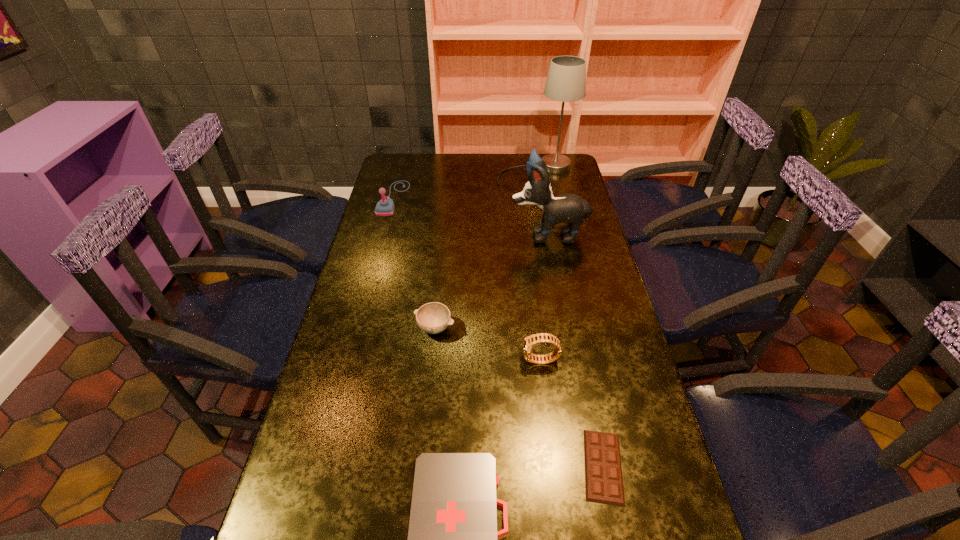
The image size is (960, 540). In order to click on table lamp in this screenshot , I will do `click(566, 82)`.

I want to click on the third farthest object, so click(x=567, y=208).

You are a GUI agent. You are given a task and a screenshot of the screen. Output one action in this format:
    pyautogui.click(x=<x>, y=<y>)
    Task: Click on the puppy
    
    Given the screenshot: What is the action you would take?
    pyautogui.click(x=567, y=208)

What are the coordinates of `the leftmost object` in the screenshot? It's located at (385, 207).

Find the location of a particular element. watch is located at coordinates (529, 341).

This screenshot has height=540, width=960. I want to click on the fourth farthest object, so click(433, 318).

Image resolution: width=960 pixels, height=540 pixels. Find the location of `the fifth tallest object`. the fifth tallest object is located at coordinates (433, 318).

At what (x,y) coordinates should I click in order to perform the action: click on chocolate bar. Please return your answer as a coordinate pair (x, y). Looking at the image, I should click on click(x=603, y=473).

Find the location of `vacant area located 0.400m on the left of the table lamp`. vacant area located 0.400m on the left of the table lamp is located at coordinates (405, 171).

This screenshot has width=960, height=540. I want to click on vacant area located on the front-facing side of the puppy, so click(x=410, y=235).